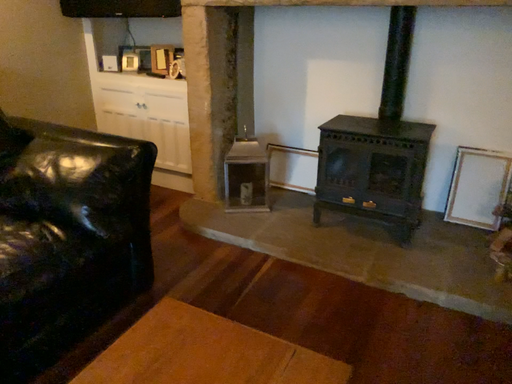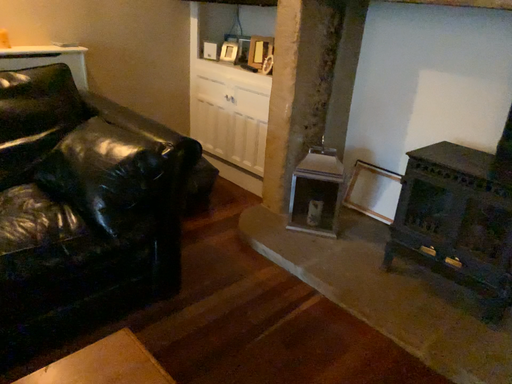
Question: Which way did the camera rotate in the video?

Choices:
 (A) rotated right
 (B) rotated left

Answer: (B)